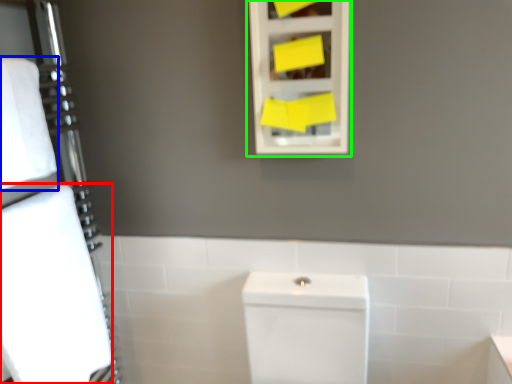
Question: Estimate the real-world distances between objects in this image. Which object is farther from bath towel (highlighted by a red box), bath towel (highlighted by a blue box) or medicine cabinet (highlighted by a green box)?

Choices:
 (A) bath towel
 (B) medicine cabinet

Answer: (B)